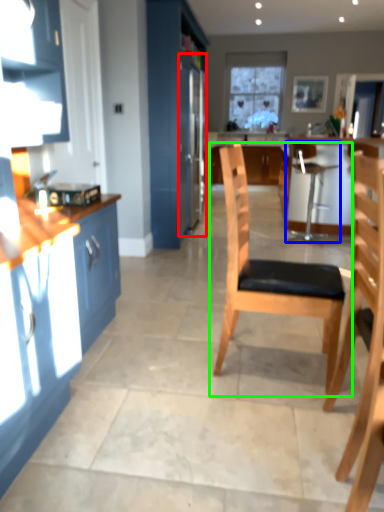
Question: Which object is positioned closest to refrigerator (highlighted by a red box)? Select from chair (highlighted by a blue box) and chair (highlighted by a green box).

Choices:
 (A) chair
 (B) chair

Answer: (A)